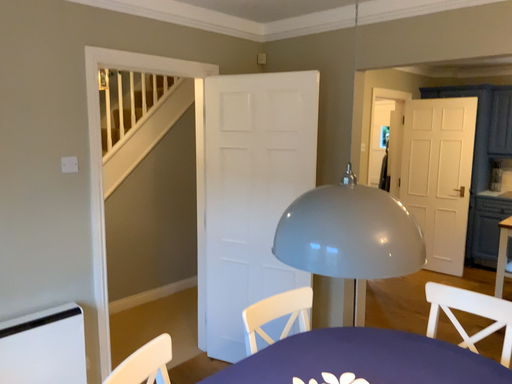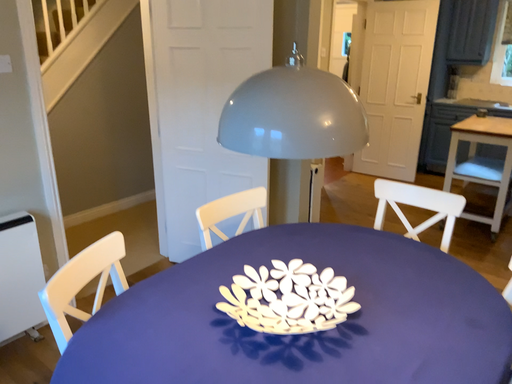
Question: Which way did the camera rotate in the video?

Choices:
 (A) rotated upward
 (B) rotated downward

Answer: (B)